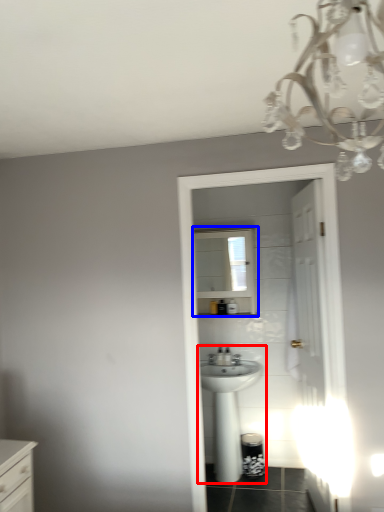
Question: Which point is further to the camera, sink (highlighted by a red box) or medicine cabinet (highlighted by a blue box)?

Choices:
 (A) sink
 (B) medicine cabinet

Answer: (B)